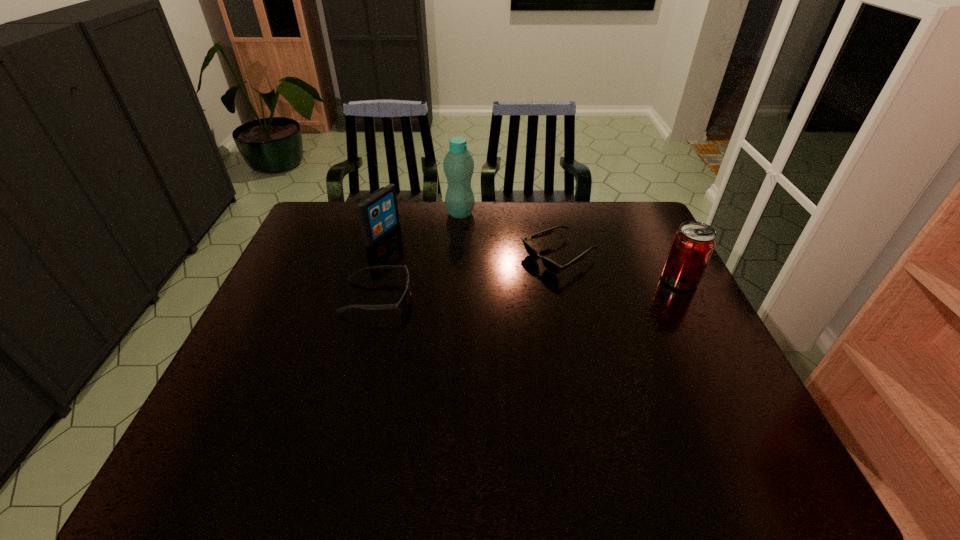
Where is `the left sunglasses`? This screenshot has height=540, width=960. the left sunglasses is located at coordinates (401, 305).

The width and height of the screenshot is (960, 540). What are the coordinates of `pop soda` in the screenshot? It's located at (692, 246).

At what (x,y) coordinates should I click in order to perform the action: click on the right sunglasses. Please return your answer as a coordinate pair (x, y). Looking at the image, I should click on (550, 265).

Locate an element on the screen. The width and height of the screenshot is (960, 540). the tallest object is located at coordinates (458, 164).

The image size is (960, 540). Identify the location of water bottle. (458, 164).

Where is `the third tallest object`? This screenshot has height=540, width=960. the third tallest object is located at coordinates (378, 214).

Where is `free space located 0.340m on the front-facing side of the left sunglasses`? Image resolution: width=960 pixels, height=540 pixels. free space located 0.340m on the front-facing side of the left sunglasses is located at coordinates (530, 297).

You are a GUI agent. You are given a task and a screenshot of the screen. Output one action in this format:
    pyautogui.click(x=<x>, y=<y>)
    Task: Click on the vacant space located on the left of the pop soda
    
    Given the screenshot: What is the action you would take?
    pyautogui.click(x=564, y=280)

The height and width of the screenshot is (540, 960). Identify the location of free space located 0.230m on the front-facing side of the right sunglasses. coord(468,302).

Locate an element on the screen. The height and width of the screenshot is (540, 960). vacant space situated 0.310m on the front-facing side of the right sunglasses is located at coordinates (445, 314).